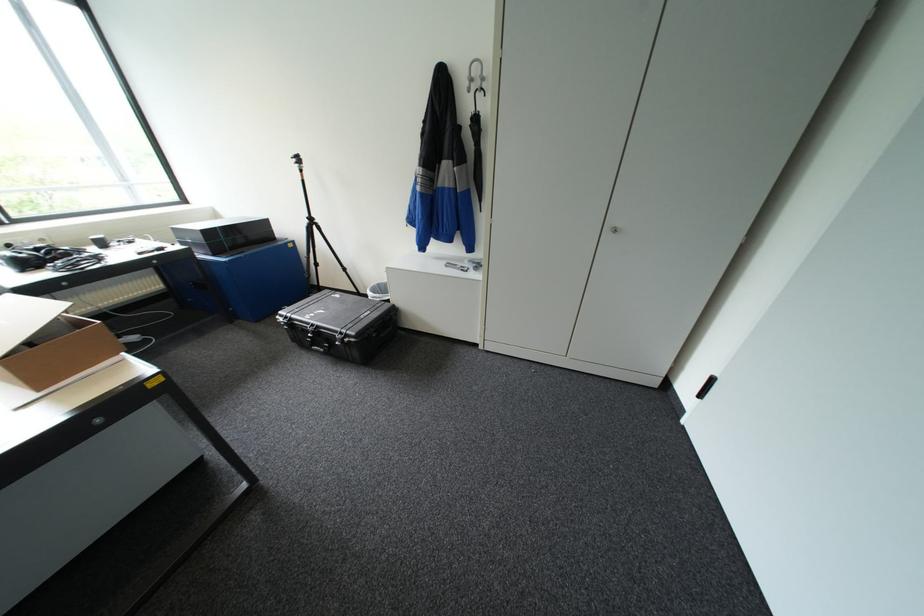
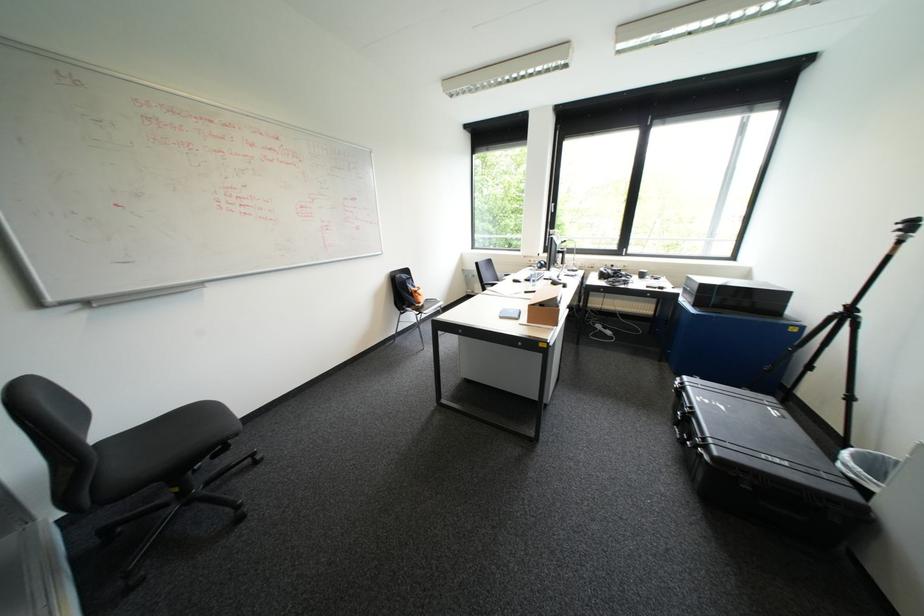
Locate, in the second image, the point that corresponds to (322,346) in the first image.

(684, 426)